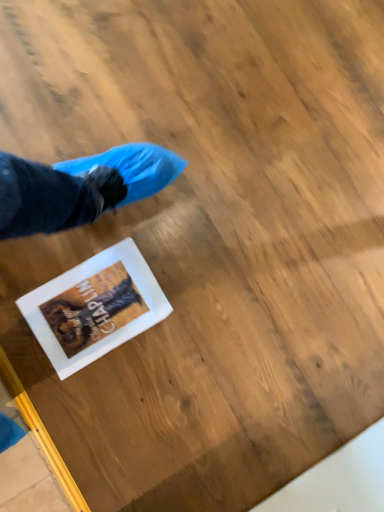
Where is `white glossy postcard at lower center`? The height and width of the screenshot is (512, 384). white glossy postcard at lower center is located at coordinates (95, 307).

This screenshot has height=512, width=384. What do you see at coordinates (95, 307) in the screenshot?
I see `white glossy postcard at lower center` at bounding box center [95, 307].

At what (x,y) coordinates should I click in order to perform the action: click on white glossy postcard at lower center. Please return your answer as a coordinate pair (x, y). The width and height of the screenshot is (384, 512). Looking at the image, I should click on (95, 307).